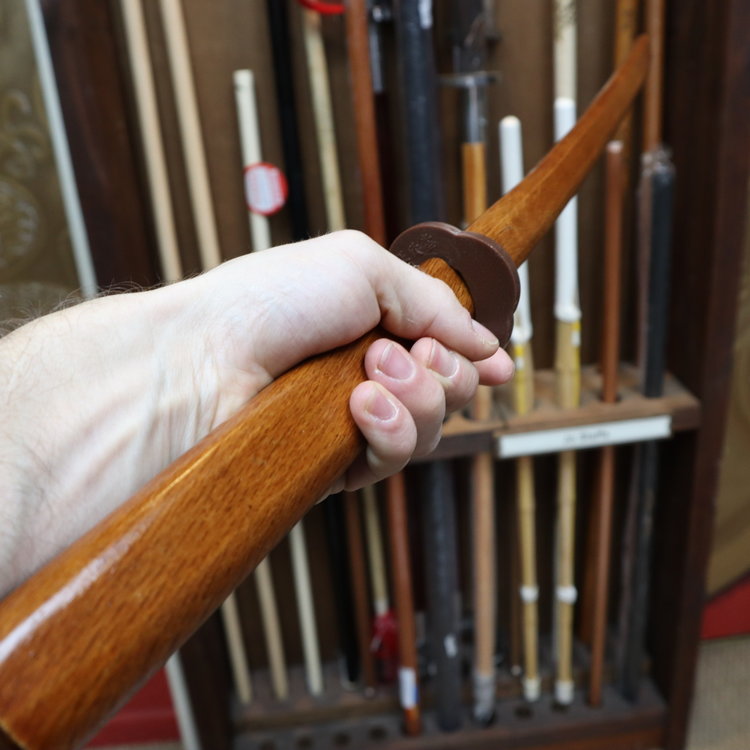
Identify the location of wood handle. The image size is (750, 750). (261, 463).